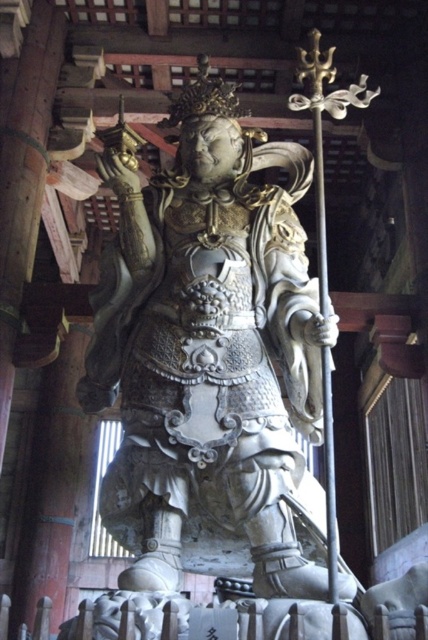
Question: Does white stone statue at center have a lesser width compared to polished wood pole at center?

Choices:
 (A) no
 (B) yes

Answer: (A)

Question: Can you confirm if white stone statue at center is thinner than polished wood pole at center?

Choices:
 (A) yes
 (B) no

Answer: (B)

Question: Which object is closer to the camera taking this photo?

Choices:
 (A) polished wood pole at center
 (B) white stone statue at center

Answer: (A)

Question: Which of the following is the farthest from the observer?

Choices:
 (A) (318, 100)
 (B) (256, 477)

Answer: (A)

Question: Does white stone statue at center come in front of polished wood pole at center?

Choices:
 (A) no
 (B) yes

Answer: (A)

Question: Among these objects, which one is farthest from the camera?

Choices:
 (A) white stone statue at center
 (B) polished wood pole at center

Answer: (A)